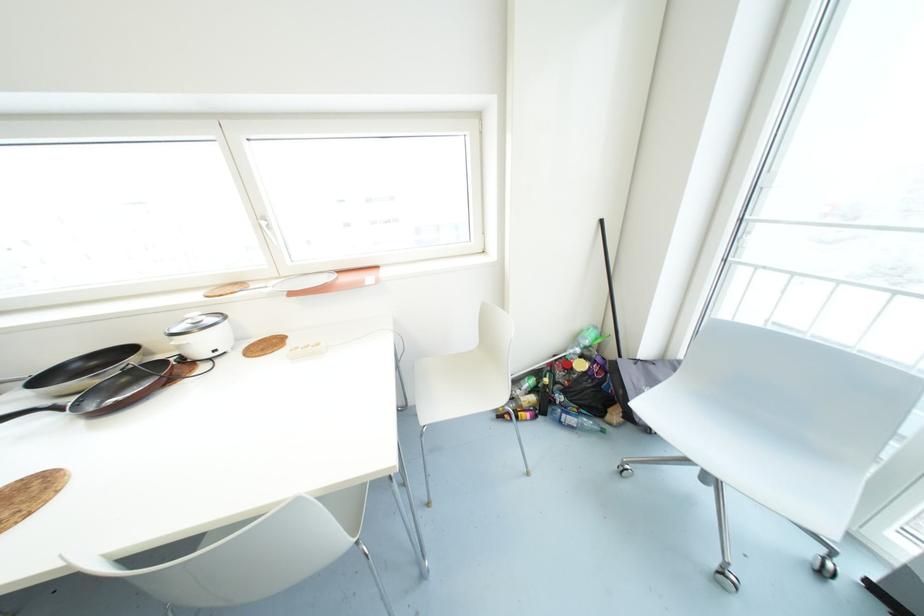
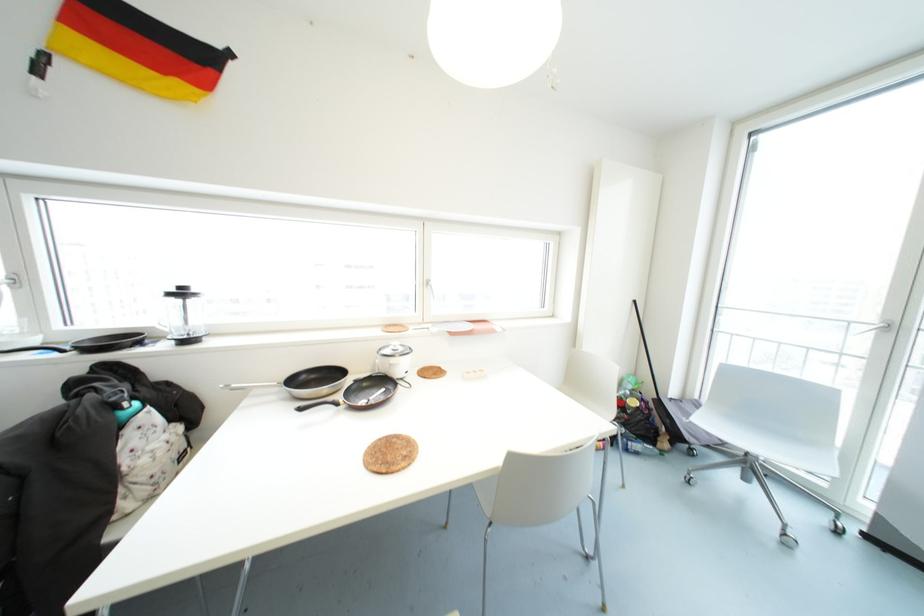
Find the pixel in the second image that matches (176,345) in the first image.

(390, 363)